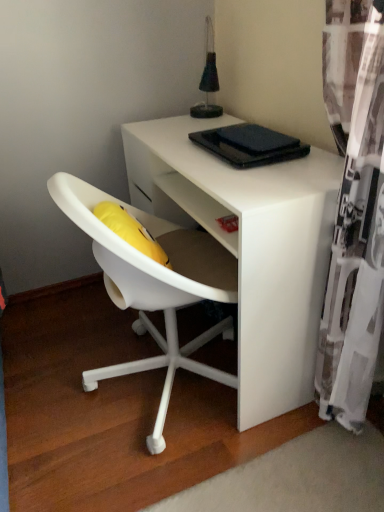
Question: From a real-world perspective, does white sheer curtain at right stand above white matte desk at center?

Choices:
 (A) yes
 (B) no

Answer: (A)

Question: From a real-world perspective, is white sheer curtain at right positioned under white matte desk at center based on gravity?

Choices:
 (A) no
 (B) yes

Answer: (A)

Question: Would you say white sheer curtain at right contains white matte desk at center?

Choices:
 (A) yes
 (B) no

Answer: (B)

Question: Considering the relative sizes of white sheer curtain at right and white matte desk at center in the image provided, is white sheer curtain at right taller than white matte desk at center?

Choices:
 (A) yes
 (B) no

Answer: (A)

Question: Is white sheer curtain at right positioned behind white matte desk at center?

Choices:
 (A) yes
 (B) no

Answer: (B)

Question: Is point pyautogui.click(x=238, y=126) positioned closer to the camera than point pyautogui.click(x=324, y=311)?

Choices:
 (A) closer
 (B) farther

Answer: (B)

Question: Considering the positions of black matte pad at upper center and white sheer curtain at right in the image, is black matte pad at upper center bigger or smaller than white sheer curtain at right?

Choices:
 (A) big
 (B) small

Answer: (B)

Question: Visually, is black matte pad at upper center positioned to the left or to the right of white sheer curtain at right?

Choices:
 (A) right
 (B) left

Answer: (B)

Question: Is black matte pad at upper center spatially inside white sheer curtain at right, or outside of it?

Choices:
 (A) outside
 (B) inside

Answer: (A)

Question: In terms of size, does black matte pad at upper center appear bigger or smaller than white matte desk at center?

Choices:
 (A) big
 (B) small

Answer: (B)

Question: From the image's perspective, is black matte pad at upper center above or below white matte desk at center?

Choices:
 (A) above
 (B) below

Answer: (A)

Question: Looking at their shapes, would you say black matte pad at upper center is wider or thinner than white matte desk at center?

Choices:
 (A) wide
 (B) thin

Answer: (B)

Question: Is point (223, 132) closer or farther from the camera than point (168, 194)?

Choices:
 (A) closer
 (B) farther

Answer: (A)

Question: In the image, is white matte desk at center positioned in front of or behind black matte pad at upper center?

Choices:
 (A) behind
 (B) front

Answer: (B)

Question: Considering the positions of white matte desk at center and black matte pad at upper center in the image, is white matte desk at center bigger or smaller than black matte pad at upper center?

Choices:
 (A) big
 (B) small

Answer: (A)